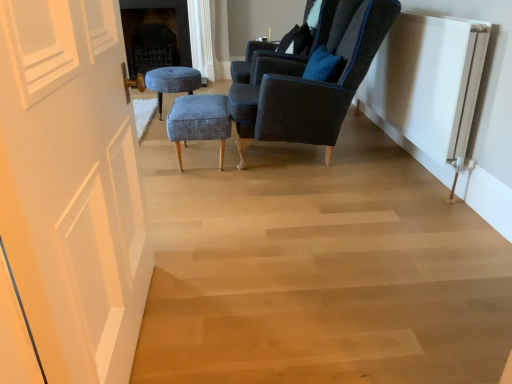
Question: Based on their positions, is velvet dark blue armchair at upper right, positioned as the first chair in back-to-front order, located to the left or right of white ribbed radiator at right?

Choices:
 (A) right
 (B) left

Answer: (B)

Question: Considering the positions of velvet dark blue armchair at upper right, the 2th chair from the front, and white ribbed radiator at right in the image, is velvet dark blue armchair at upper right, the 2th chair from the front, bigger or smaller than white ribbed radiator at right?

Choices:
 (A) big
 (B) small

Answer: (A)

Question: Which object is positioned closest to the velvet dark blue armchair at center, marked as the second chair in a back-to-front arrangement?

Choices:
 (A) blue fabric stool at center, arranged as the 2th stool when viewed from the left
 (B) velvet blue stool at center, arranged as the first stool when viewed from the back
 (C) velvet dark blue armchair at upper right, positioned as the first chair in back-to-front order
 (D) white ribbed radiator at right
 (E) dark gray stone fireplace at upper center

Answer: (C)

Question: Based on their relative distances, which object is farther from the velvet blue stool at center, which appears as the 1th stool when viewed from the top?

Choices:
 (A) white painted wood door at left
 (B) blue fabric stool at center, positioned as the 2th stool in back-to-front order
 (C) velvet dark blue armchair at upper right, the 2th chair from the front
 (D) velvet dark blue armchair at center, the 1th chair viewed from the front
 (E) dark gray stone fireplace at upper center

Answer: (A)